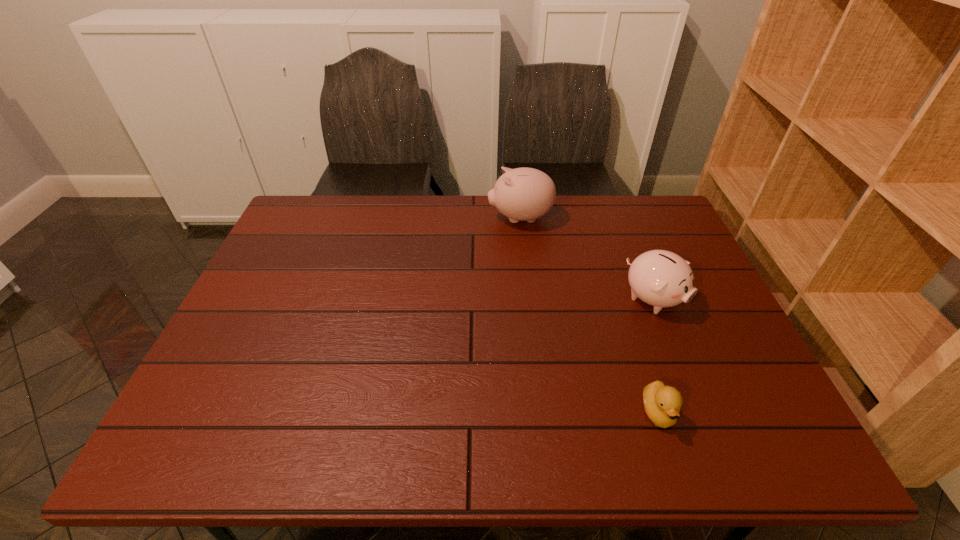
Locate an element on the screen. The image size is (960, 540). free space at the near right corner of the desktop is located at coordinates (744, 429).

Identify the location of free spot between the duckling and the farthest object. This screenshot has height=540, width=960. (589, 315).

At what (x,y) coordinates should I click in order to perform the action: click on free space that is in between the tallest object and the duckling. Please return your answer as a coordinate pair (x, y). The height and width of the screenshot is (540, 960). Looking at the image, I should click on (589, 315).

Identify the location of empty space between the duckling and the taller piggy bank. (589, 315).

This screenshot has width=960, height=540. Find the location of `free space between the shorter piggy bank and the nearest object`. free space between the shorter piggy bank and the nearest object is located at coordinates (656, 356).

Locate an element on the screen. empty space between the shortest object and the second shortest object is located at coordinates (656, 356).

Locate an element on the screen. This screenshot has width=960, height=540. empty location between the leftmost object and the nearer piggy bank is located at coordinates (587, 259).

The width and height of the screenshot is (960, 540). Identify the location of free space between the shorter piggy bank and the farthest object. (587, 259).

Find the location of a particular element. free space between the second tallest object and the leftmost object is located at coordinates (587, 259).

The height and width of the screenshot is (540, 960). Find the location of `free spot between the farther piggy bank and the shorter piggy bank`. free spot between the farther piggy bank and the shorter piggy bank is located at coordinates [x=587, y=259].